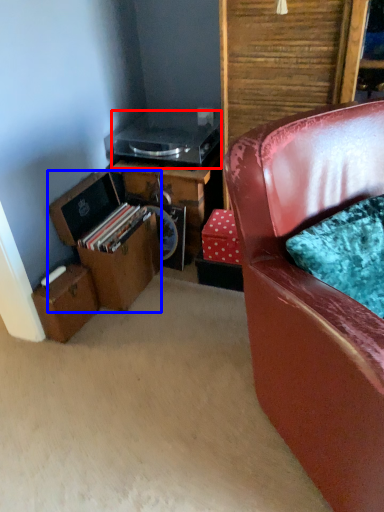
Question: Which point is further to the camera, appliance (highlighted by a red box) or box (highlighted by a blue box)?

Choices:
 (A) appliance
 (B) box

Answer: (A)